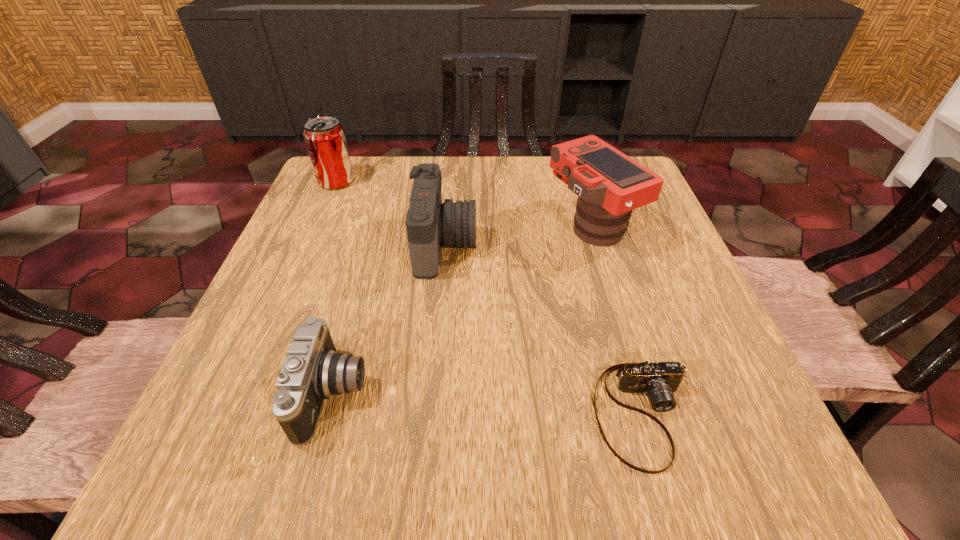
Identify the location of camera present at the far edge. (610, 185).

Locate an element on the screen. The height and width of the screenshot is (540, 960). pop soda present at the far edge is located at coordinates (325, 138).

Image resolution: width=960 pixels, height=540 pixels. Identify the location of pop soda located at the left edge. (325, 138).

This screenshot has width=960, height=540. I want to click on camera located at the left edge, so click(x=312, y=371).

This screenshot has height=540, width=960. Identify the location of object at the far left corner. (325, 138).

Identify the location of object located at the near left corner. This screenshot has height=540, width=960. (312, 371).

Where is `object that is at the far right corner`? object that is at the far right corner is located at coordinates (610, 185).

Where is `object that is at the near right corner`? The width and height of the screenshot is (960, 540). object that is at the near right corner is located at coordinates (x=658, y=381).

I want to click on vacant space at the far edge of the desktop, so click(491, 195).

The image size is (960, 540). Find the location of `free space at the left edge of the desktop`. free space at the left edge of the desktop is located at coordinates (356, 232).